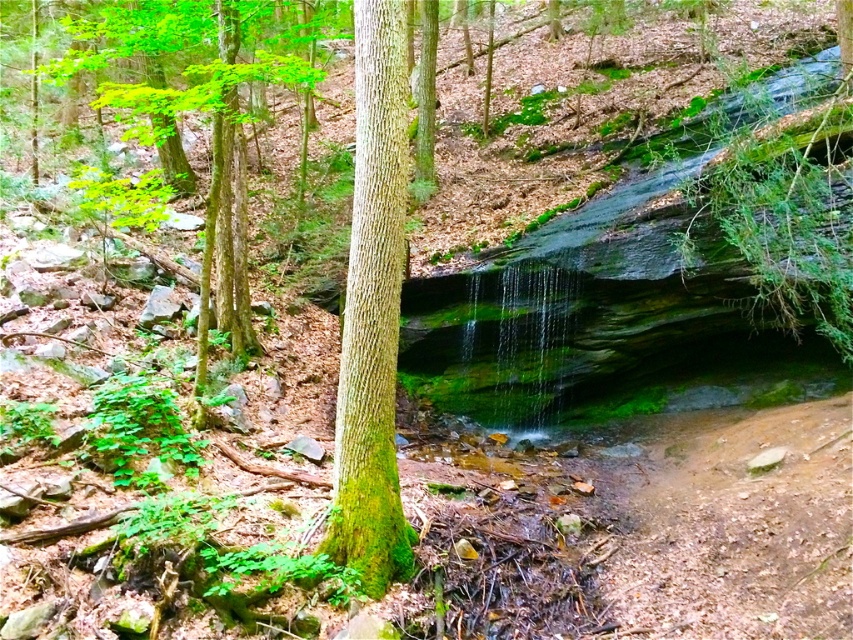
Is point (366, 196) farther from viewer compared to point (256, 349)?

No, (366, 196) is in front of (256, 349).

This screenshot has width=853, height=640. Describe the element at coordinates (372, 312) in the screenshot. I see `green mossy bark tree at center` at that location.

I want to click on green mossy bark tree at center, so click(x=372, y=312).

Where is `green mossy bark tree at center`? green mossy bark tree at center is located at coordinates (372, 312).